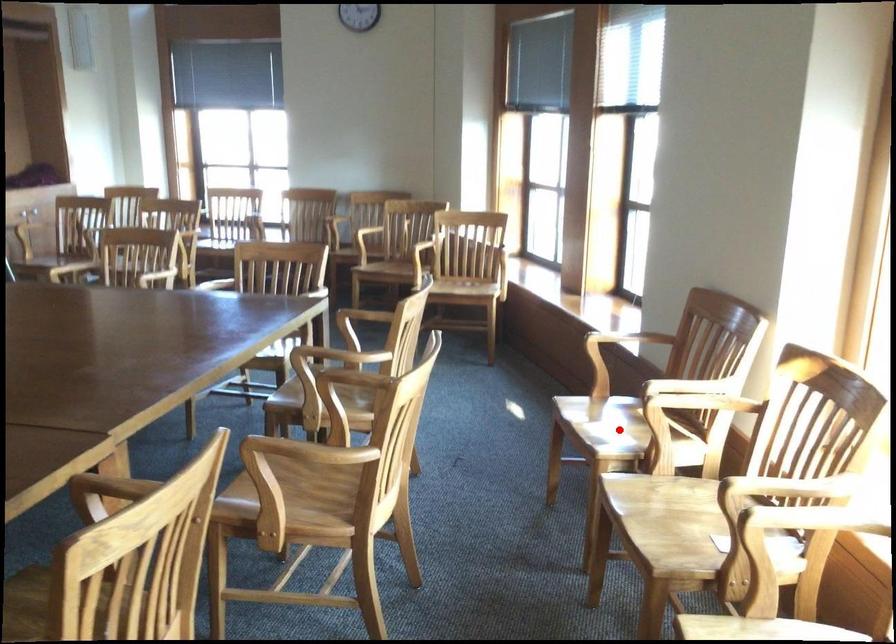
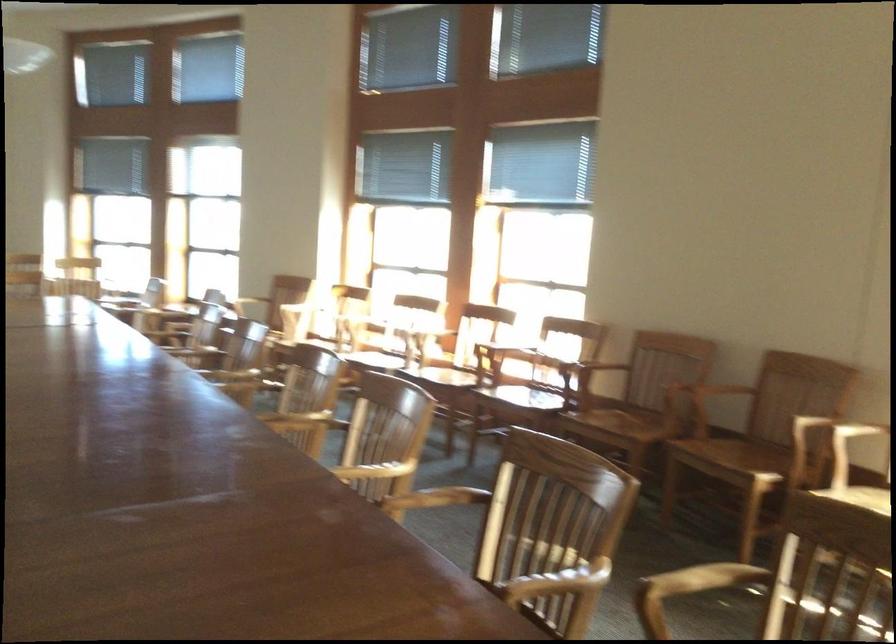
Question: I am providing you with two images of the same scene from different viewpoints. A red point is marked on the first image. Can you still see the location of the red point in image 2?

Choices:
 (A) Yes
 (B) No

Answer: (B)